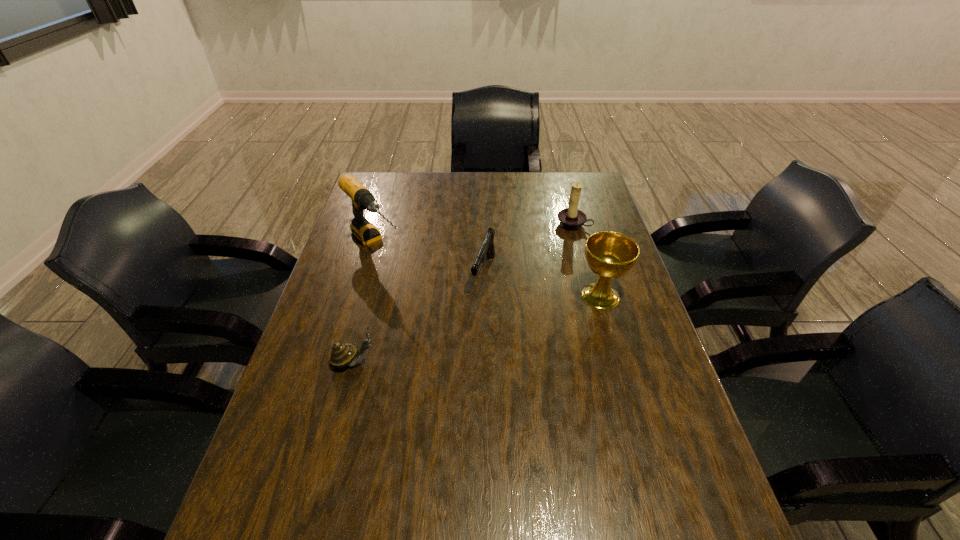
Locate an element on the screen. This screenshot has width=960, height=540. vacant space on the desktop that is between the snail and the chalice and is positioned on the wick of the candle holder is located at coordinates (492, 325).

Identify the location of free spot on the desktop that is between the nearest object and the chalice and is positioned at the aiming end of the third object from left to right. (460, 334).

This screenshot has width=960, height=540. I want to click on free space on the desktop that is between the nearest object and the chalice and is positioned on the handle side of the drill, so click(x=461, y=333).